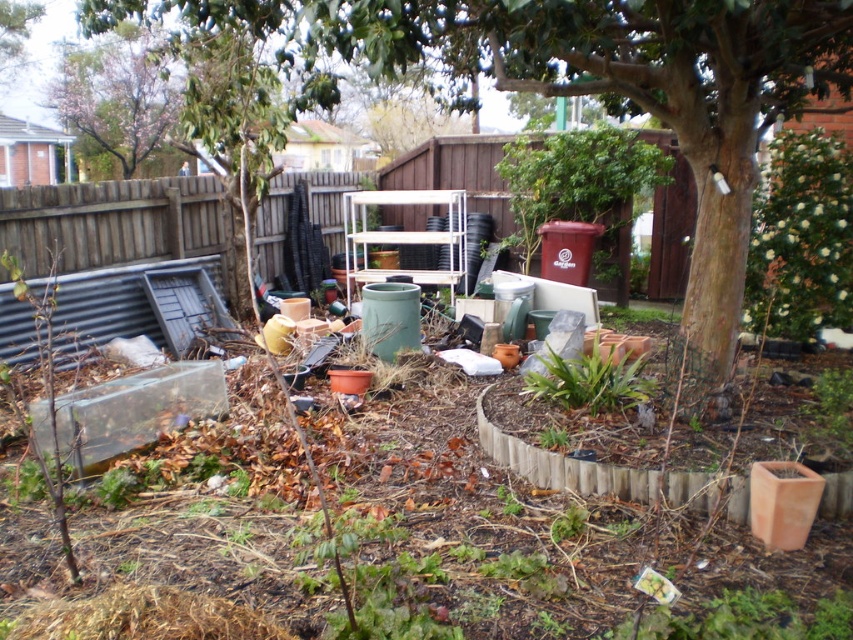
You are a gardener who needs to plant a new tree that requires 15 feet of space between it and any structure. You see the green leafy tree at center and the brown wooden fence at upper left. Can you plant the new tree between them without violating the spacing requirement?

The distance between the green leafy tree at center and the brown wooden fence at upper left is 12.38 feet, which is less than the required 15 feet. Therefore, planting a new tree between them would not meet the spacing requirement.

You are a gardener who wants to plant a new shrub between the green leafy tree at center and the brown wooden fence at upper left. Based on their positions, where should you place the shrub so it is closer to the tree but still within the garden bed?

The green leafy tree at center is below the brown wooden fence at upper left, so you should plant the shrub between them closer to the green leafy tree at center to ensure it stays within the garden bed.